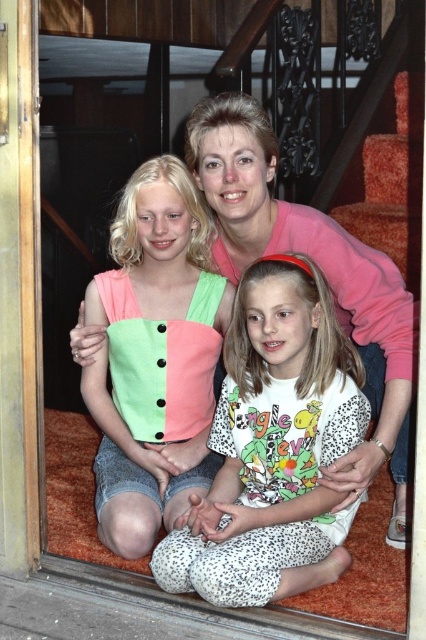
Between white leopard print pajama pants at center and matte cotton tank top at center, which one has less height?

white leopard print pajama pants at center is shorter.

Is white leopard print pajama pants at center further to the viewer compared to matte cotton tank top at center?

That is False.

Identify the location of white leopard print pajama pants at center. Image resolution: width=426 pixels, height=640 pixels. (273, 449).